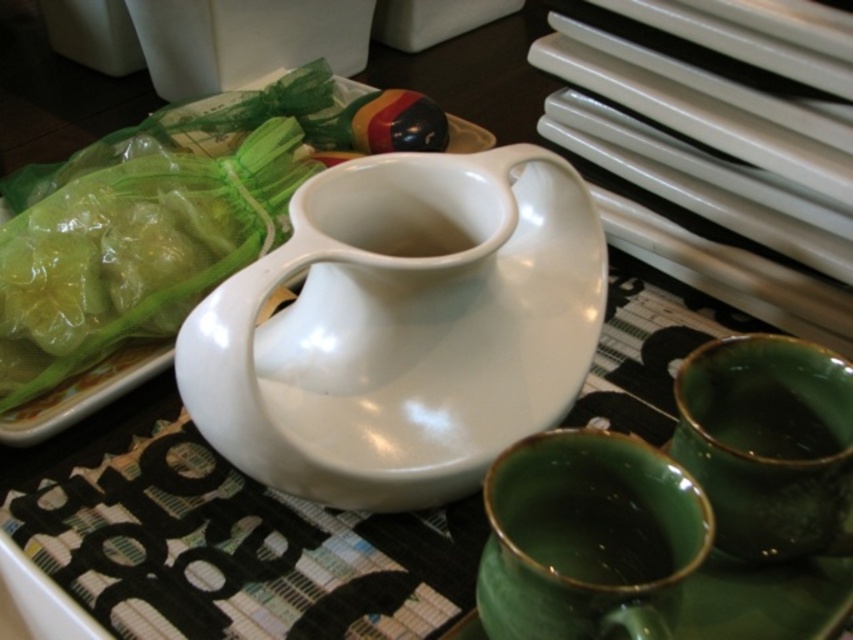
Based on the photo, you are setting up a dining table and need to place a dessert in the white glossy bowl at center and drinks in the green glossy cups at lower right. Which container has a larger capacity for holding liquid?

The white glossy bowl at center has a larger capacity for holding liquid than the green glossy cups at lower right because it is bigger than them.

You are setting up a dinner table and need to pour sauce for multiple guests. The white glossy jug at center and the green glossy gravy boat at lower right are available. Which one should you choose for the task and why?

The white glossy jug at center is larger in size than the green glossy gravy boat at lower right, so it can hold more sauce and is better suited for pouring sauce for multiple guests.